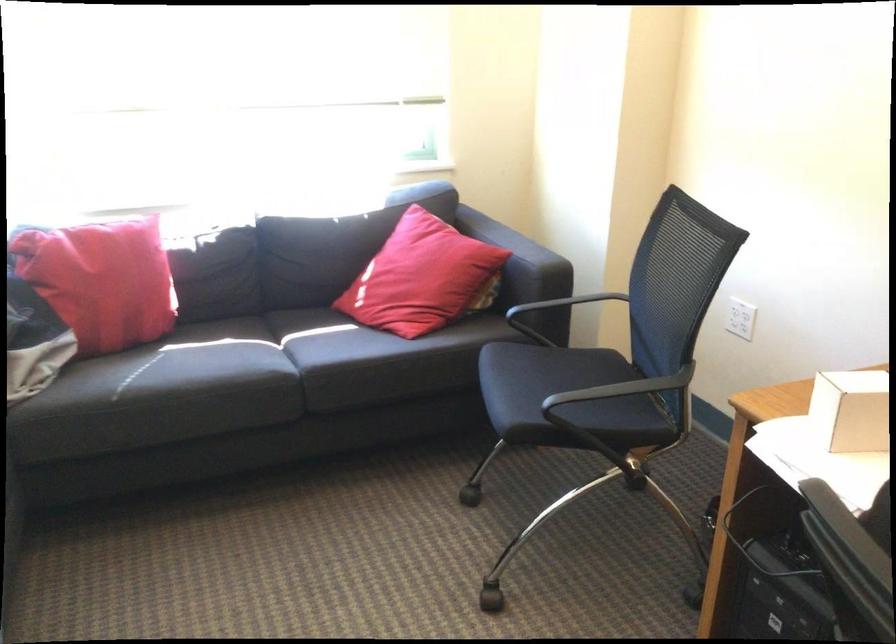
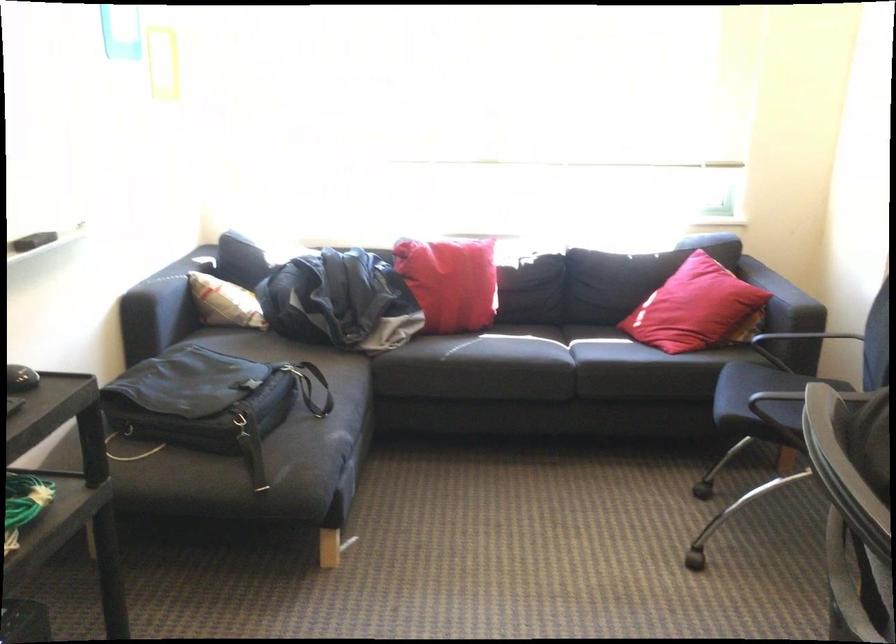
In the second image, find the point that corresponds to point 515,258 in the first image.

(782, 298)